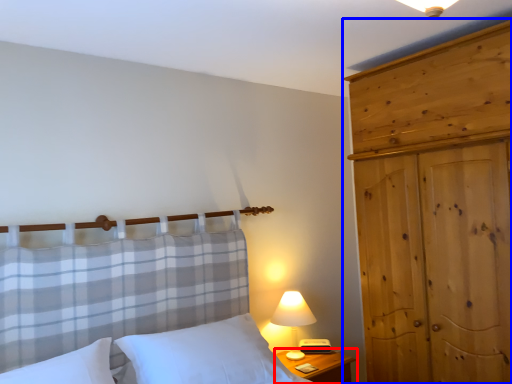
Question: Which point is further to the camera, nightstand (highlighted by a red box) or dresser (highlighted by a blue box)?

Choices:
 (A) nightstand
 (B) dresser

Answer: (A)